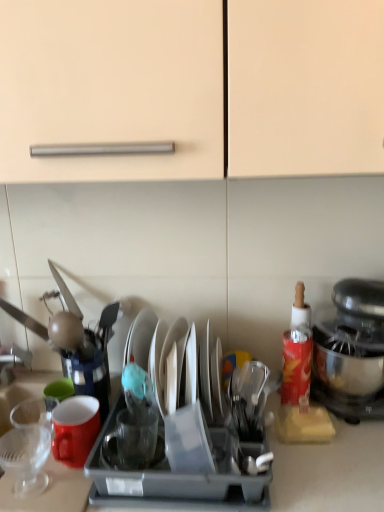
Question: Can you see shiny silver plate at center, which appears as the 1th tableware when viewed from the right, touching transparent glass cup at center, marked as the second tableware in a right-to-left arrangement?

Choices:
 (A) no
 (B) yes

Answer: (A)

Question: Does shiny silver plate at center, which is the third tableware from left to right, have a greater height compared to transparent glass cup at center, the 2th tableware viewed from the left?

Choices:
 (A) yes
 (B) no

Answer: (A)

Question: From a real-world perspective, is shiny silver plate at center, which is the third tableware from left to right, physically above transparent glass cup at center, marked as the second tableware in a right-to-left arrangement?

Choices:
 (A) yes
 (B) no

Answer: (A)

Question: Is shiny silver plate at center, which is the third tableware from left to right, smaller than transparent glass cup at center, marked as the second tableware in a right-to-left arrangement?

Choices:
 (A) yes
 (B) no

Answer: (B)

Question: Can you confirm if shiny silver plate at center, which appears as the 1th tableware when viewed from the right, is positioned to the right of transparent glass cup at center, the 2th tableware viewed from the left?

Choices:
 (A) yes
 (B) no

Answer: (A)

Question: In terms of height, does transparent glass cup at center, the 2th tableware viewed from the left, look taller or shorter compared to metallic silver stand mixer at right?

Choices:
 (A) tall
 (B) short

Answer: (B)

Question: From the image's perspective, is transparent glass cup at center, the 2th tableware viewed from the left, above or below metallic silver stand mixer at right?

Choices:
 (A) below
 (B) above

Answer: (A)

Question: Considering their positions, is transparent glass cup at center, the 2th tableware viewed from the left, located in front of or behind metallic silver stand mixer at right?

Choices:
 (A) front
 (B) behind

Answer: (A)

Question: Is point (152, 422) positioned closer to the camera than point (352, 370)?

Choices:
 (A) farther
 (B) closer

Answer: (B)

Question: Based on their sizes in the image, would you say transparent glass cup at center, the 2th tableware viewed from the left, is bigger or smaller than shiny silver plate at center, which appears as the 1th tableware when viewed from the right?

Choices:
 (A) big
 (B) small

Answer: (B)

Question: Choose the correct answer: Is transparent glass cup at center, marked as the second tableware in a right-to-left arrangement, inside shiny silver plate at center, which is the third tableware from left to right, or outside it?

Choices:
 (A) outside
 (B) inside

Answer: (A)

Question: From their relative heights in the image, would you say transparent glass cup at center, marked as the second tableware in a right-to-left arrangement, is taller or shorter than shiny silver plate at center, which is the third tableware from left to right?

Choices:
 (A) tall
 (B) short

Answer: (B)

Question: Looking at their shapes, would you say transparent glass cup at center, the 2th tableware viewed from the left, is wider or thinner than shiny silver plate at center, which appears as the 1th tableware when viewed from the right?

Choices:
 (A) wide
 (B) thin

Answer: (B)

Question: In terms of width, does matte ceramic mug at left look wider or thinner when compared to red matte bottle at right?

Choices:
 (A) wide
 (B) thin

Answer: (A)

Question: Is point (64, 462) closer or farther from the camera than point (291, 380)?

Choices:
 (A) closer
 (B) farther

Answer: (A)